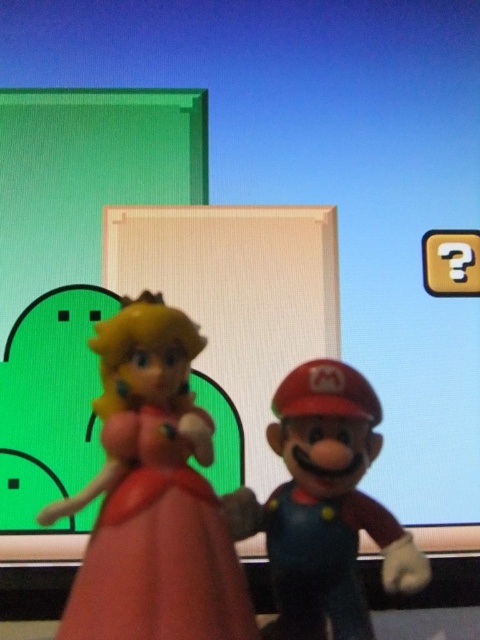
Where is `matte pink princess at center`? matte pink princess at center is located at coordinates (153, 496).

Is point (134, 572) closer to viewer compared to point (395, 522)?

Yes, point (134, 572) is in front of point (395, 522).

Is point (124, 461) positioned in front of point (407, 577)?

No.

Find the location of a particular element. matte pink princess at center is located at coordinates (153, 496).